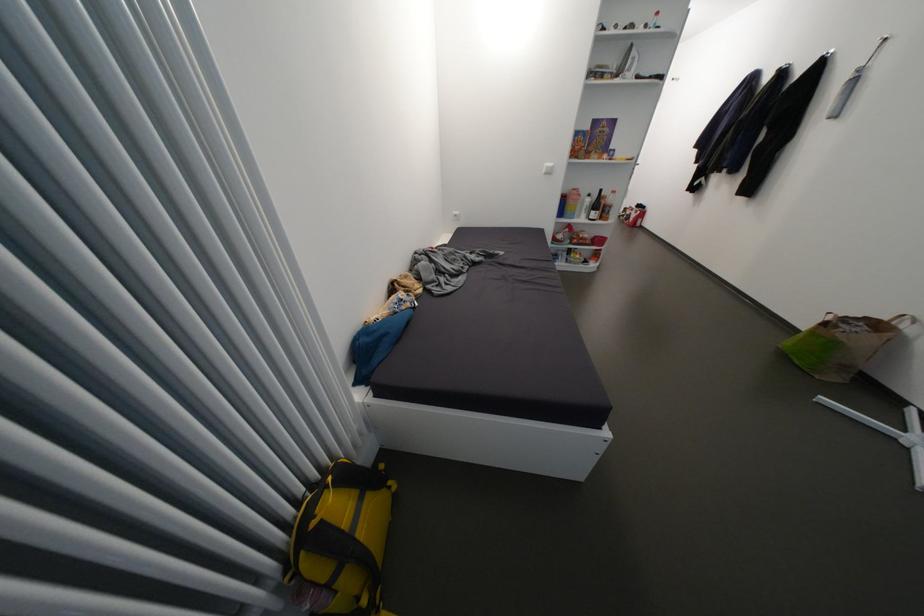
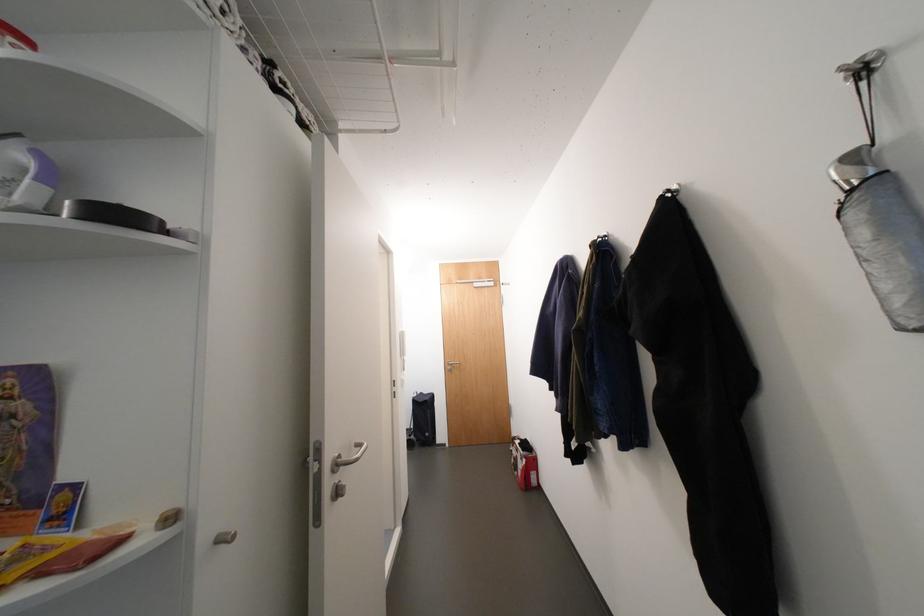
Find the pixel in the second image that matches (x=869, y=70) in the first image.

(864, 159)